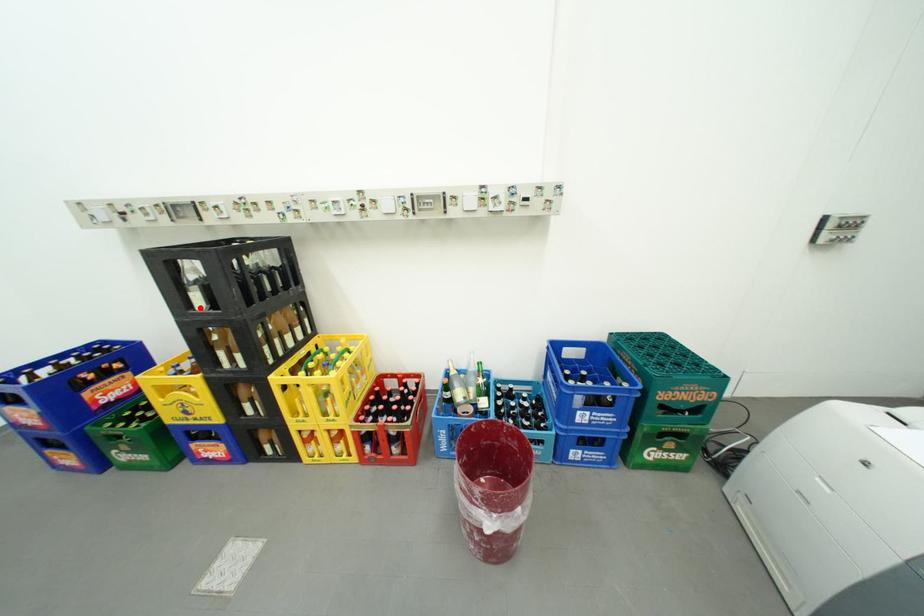
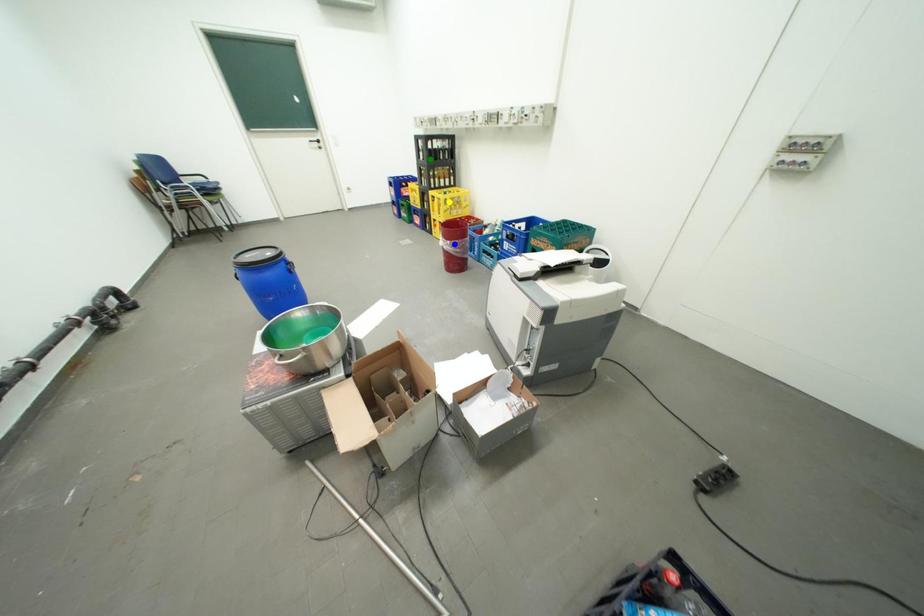
Question: I am providing you with two images of the same scene from different viewpoints. A red point is marked on the first image. You are given multiple points on the second image. Which point in image 2 represents the same 3d spot as the red point in image 1?

Choices:
 (A) blue point
 (B) green point
 (C) yellow point

Answer: (B)